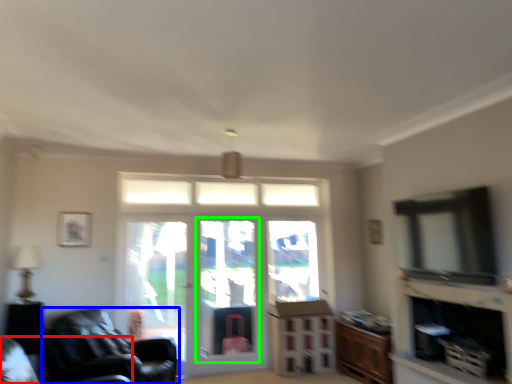
Question: Which object is the closest to the chair (highlighted by a red box)? Choose among these: chair (highlighted by a blue box) or screen door (highlighted by a green box).

Choices:
 (A) chair
 (B) screen door

Answer: (A)